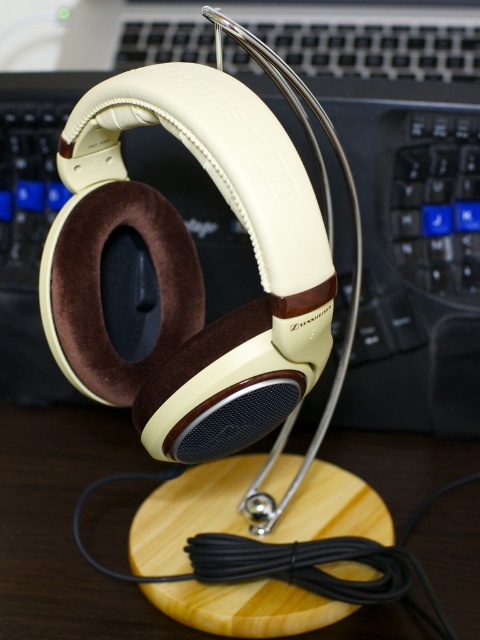
Question: Can you confirm if matte cream leather headphones at center is wider than wooden table at center?

Choices:
 (A) no
 (B) yes

Answer: (B)

Question: Among these points, which one is nearest to the camera?

Choices:
 (A) (x=94, y=612)
 (B) (x=231, y=10)

Answer: (A)

Question: Does matte cream leather headphones at center have a lesser width compared to wooden table at center?

Choices:
 (A) no
 (B) yes

Answer: (A)

Question: Is matte cream leather headphones at center bigger than wooden table at center?

Choices:
 (A) no
 (B) yes

Answer: (B)

Question: Among these objects, which one is farthest from the camera?

Choices:
 (A) matte cream leather headphones at center
 (B) wooden table at center

Answer: (A)